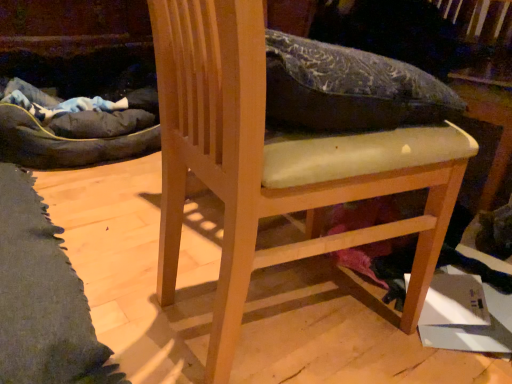
Question: In the image, is light wood chair at center positioned in front of or behind white cardboard box at lower right?

Choices:
 (A) front
 (B) behind

Answer: (A)

Question: Considering the positions of light wood chair at center and white cardboard box at lower right in the image, is light wood chair at center wider or thinner than white cardboard box at lower right?

Choices:
 (A) thin
 (B) wide

Answer: (B)

Question: Based on their sizes in the image, would you say light wood chair at center is bigger or smaller than white cardboard box at lower right?

Choices:
 (A) small
 (B) big

Answer: (B)

Question: From the image's perspective, relative to light wood chair at center, is white cardboard box at lower right above or below?

Choices:
 (A) below
 (B) above

Answer: (A)

Question: Considering their positions, is white cardboard box at lower right located in front of or behind light wood chair at center?

Choices:
 (A) front
 (B) behind

Answer: (B)

Question: Is white cardboard box at lower right wider or thinner than light wood chair at center?

Choices:
 (A) thin
 (B) wide

Answer: (A)

Question: From a real-world perspective, is white cardboard box at lower right above or below light wood chair at center?

Choices:
 (A) above
 (B) below

Answer: (B)